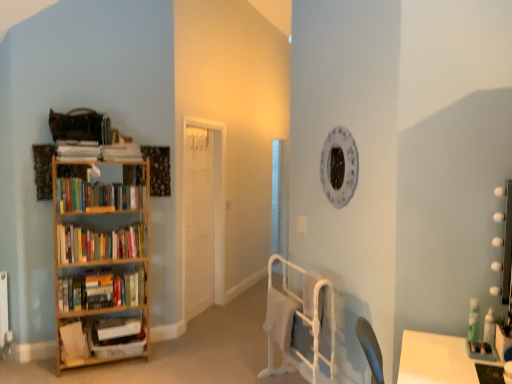
Question: Is wooden bookshelf at left smaller than hardcover books at left, which is counted as the first book, starting from the top?

Choices:
 (A) no
 (B) yes

Answer: (A)

Question: Can you confirm if wooden bookshelf at left is wider than hardcover books at left, which is counted as the first book, starting from the top?

Choices:
 (A) no
 (B) yes

Answer: (B)

Question: Does wooden bookshelf at left have a larger size compared to hardcover books at left, which is counted as the first book, starting from the top?

Choices:
 (A) yes
 (B) no

Answer: (A)

Question: Is wooden bookshelf at left far away from hardcover books at left, which is counted as the first book, starting from the top?

Choices:
 (A) no
 (B) yes

Answer: (A)

Question: Is wooden bookshelf at left with hardcover books at left, which is counted as the first book, starting from the top?

Choices:
 (A) no
 (B) yes

Answer: (A)

Question: In the image, is white matte bookshelf at left, which ranks as the 2th book in bottom-to-top order, positioned in front of or behind white metal bed frame at lower center?

Choices:
 (A) front
 (B) behind

Answer: (B)

Question: From the image's perspective, is white matte bookshelf at left, which ranks as the 2th book in bottom-to-top order, located above or below white metal bed frame at lower center?

Choices:
 (A) above
 (B) below

Answer: (B)

Question: Choose the correct answer: Is white matte bookshelf at left, marked as the fourth book in a top-to-bottom arrangement, inside white metal bed frame at lower center or outside it?

Choices:
 (A) inside
 (B) outside

Answer: (B)

Question: Is point (69, 352) closer or farther from the camera than point (283, 327)?

Choices:
 (A) closer
 (B) farther

Answer: (B)

Question: Based on their sizes in the image, would you say white plastic crate at lower left, arranged as the fifth book when viewed from the top, is bigger or smaller than white matte door at center?

Choices:
 (A) big
 (B) small

Answer: (B)

Question: Is white plastic crate at lower left, which ranks as the 1th book in bottom-to-top order, taller or shorter than white matte door at center?

Choices:
 (A) short
 (B) tall

Answer: (A)

Question: From a real-world perspective, relative to white matte door at center, is white plastic crate at lower left, arranged as the fifth book when viewed from the top, vertically above or below?

Choices:
 (A) above
 (B) below

Answer: (B)

Question: Would you say white plastic crate at lower left, which ranks as the 1th book in bottom-to-top order, is to the left or to the right of white matte door at center in the picture?

Choices:
 (A) left
 (B) right

Answer: (A)

Question: From their relative heights in the image, would you say wooden bookshelf at left is taller or shorter than white metal bed frame at lower center?

Choices:
 (A) short
 (B) tall

Answer: (B)

Question: From a real-world perspective, is wooden bookshelf at left physically located above or below white metal bed frame at lower center?

Choices:
 (A) above
 (B) below

Answer: (A)